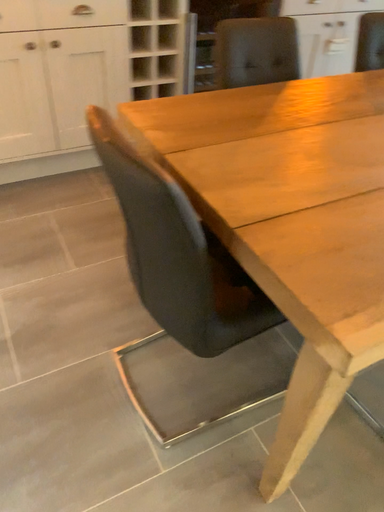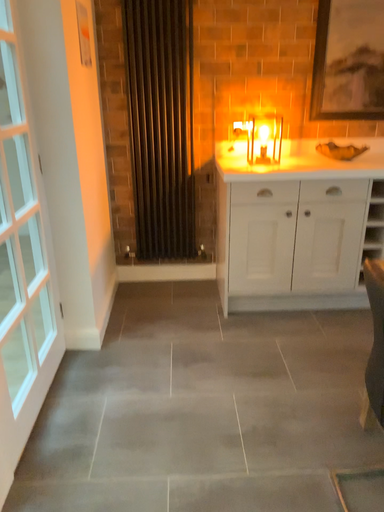
Question: Which way did the camera rotate in the video?

Choices:
 (A) rotated right
 (B) rotated left

Answer: (B)